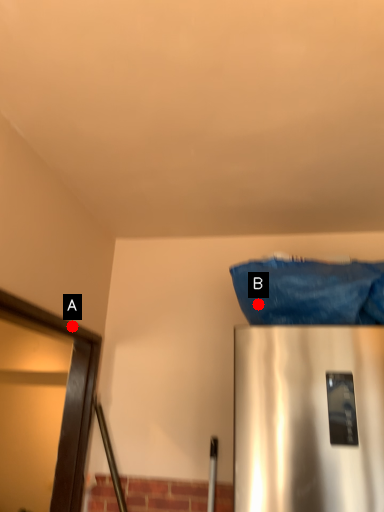
Question: Two points are circled on the image, labeled by A and B beside each circle. Which point is farther to the camera?

Choices:
 (A) A is further
 (B) B is further

Answer: (A)